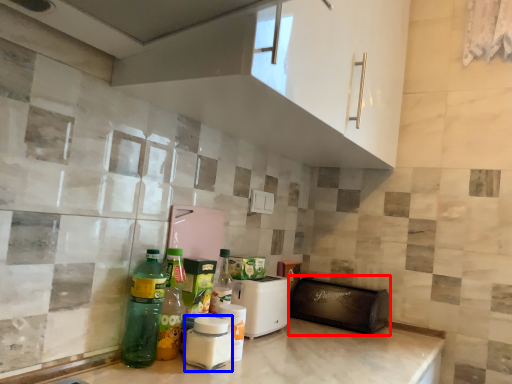
Question: Which object is further to the camera taking this photo, appliance (highlighted by a red box) or bottle (highlighted by a blue box)?

Choices:
 (A) appliance
 (B) bottle

Answer: (A)